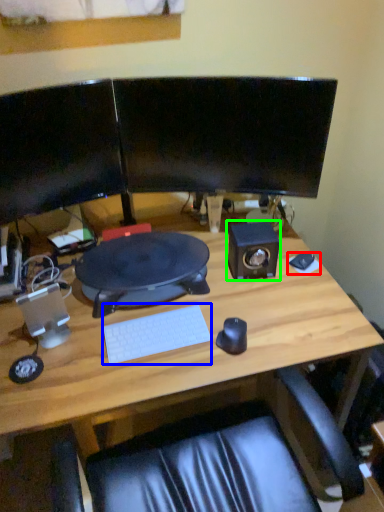
Question: Considering the real-world distances, which object is closest to mousepad (highlighted by a red box)? computer keyboard (highlighted by a blue box) or speaker (highlighted by a green box).

Choices:
 (A) computer keyboard
 (B) speaker

Answer: (B)